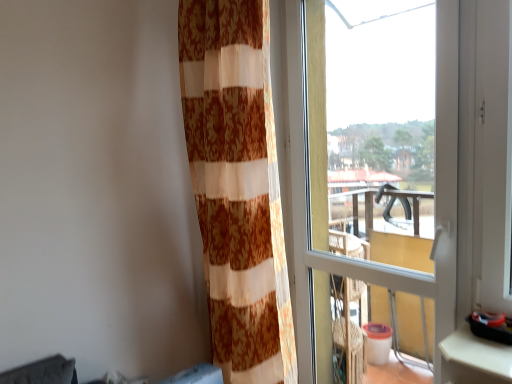
Describe the element at coordinates (435, 191) in the screenshot. I see `transparent glass window at right` at that location.

What are the coordinates of `transparent glass window at right` in the screenshot? It's located at (435, 191).

This screenshot has height=384, width=512. In order to click on orange floral sheer curtain at center in this screenshot , I will do `click(237, 186)`.

What do you see at coordinates (237, 186) in the screenshot?
I see `orange floral sheer curtain at center` at bounding box center [237, 186].

In order to face orange floral sheer curtain at center, should I rotate leftwards or rightwards?

Rotate left and turn 1.201 degrees.

At what (x,y) coordinates should I click in order to perform the action: click on transparent glass window at right. Please return your answer as a coordinate pair (x, y). Looking at the image, I should click on (435, 191).

Does transparent glass window at right appear on the right side of orange floral sheer curtain at center?

Yes.

Which is behind, transparent glass window at right or orange floral sheer curtain at center?

Positioned behind is orange floral sheer curtain at center.

Considering the positions of points (443, 277) and (236, 32), is point (443, 277) farther from camera compared to point (236, 32)?

No, it is not.

From the image's perspective, is transparent glass window at right located beneath orange floral sheer curtain at center?

Indeed, from the image's perspective, transparent glass window at right is shown beneath orange floral sheer curtain at center.

From a real-world perspective, is transparent glass window at right positioned under orange floral sheer curtain at center based on gravity?

Correct, in the physical world, transparent glass window at right is lower than orange floral sheer curtain at center.

Can you confirm if transparent glass window at right is thinner than orange floral sheer curtain at center?

Yes.

From their relative heights in the image, would you say transparent glass window at right is taller or shorter than orange floral sheer curtain at center?

Clearly, transparent glass window at right is taller compared to orange floral sheer curtain at center.

In terms of size, does transparent glass window at right appear bigger or smaller than orange floral sheer curtain at center?

transparent glass window at right is smaller than orange floral sheer curtain at center.

Does transparent glass window at right contain orange floral sheer curtain at center?

No, transparent glass window at right does not contain orange floral sheer curtain at center.

Is the surface of transparent glass window at right in direct contact with orange floral sheer curtain at center?

No, transparent glass window at right is not making contact with orange floral sheer curtain at center.

Is transparent glass window at right positioned with its back to orange floral sheer curtain at center?

Answer: Yes, transparent glass window at right is positioned with its back facing orange floral sheer curtain at center.

Can you tell me how much transparent glass window at right and orange floral sheer curtain at center differ in facing direction?

transparent glass window at right and orange floral sheer curtain at center are facing 1.72 degrees away from each other.

How distant is transparent glass window at right from orange floral sheer curtain at center?

transparent glass window at right is 16.49 inches away from orange floral sheer curtain at center.

Identify the location of window lying below the orange floral sheer curtain at center (from the image's perspective). (435, 191).

In the scene shown: Which object is positioned more to the left, orange floral sheer curtain at center or transparent glass window at right?

orange floral sheer curtain at center.

Based on the photo, is orange floral sheer curtain at center further to camera compared to transparent glass window at right?

Yes, orange floral sheer curtain at center is behind transparent glass window at right.

Is point (241, 207) in front of point (298, 98)?

Yes, point (241, 207) is in front of point (298, 98).

From the image's perspective, is orange floral sheer curtain at center located above or below transparent glass window at right?

From the image's perspective, orange floral sheer curtain at center appears above transparent glass window at right.

From a real-world perspective, is orange floral sheer curtain at center physically located above or below transparent glass window at right?

In terms of real-world spatial position, orange floral sheer curtain at center is above transparent glass window at right.

Can you confirm if orange floral sheer curtain at center is thinner than transparent glass window at right?

No.

Is orange floral sheer curtain at center taller than transparent glass window at right?

In fact, orange floral sheer curtain at center may be shorter than transparent glass window at right.

Consider the image. In terms of size, does orange floral sheer curtain at center appear bigger or smaller than transparent glass window at right?

Considering their sizes, orange floral sheer curtain at center takes up more space than transparent glass window at right.

Is orange floral sheer curtain at center surrounding transparent glass window at right?

No.

Are orange floral sheer curtain at center and transparent glass window at right making contact?

No, orange floral sheer curtain at center is not with transparent glass window at right.

Is orange floral sheer curtain at center oriented away from transparent glass window at right?

Yes, orange floral sheer curtain at center is facing away from transparent glass window at right.

Identify the location of curtain on the left of transparent glass window at right. The height and width of the screenshot is (384, 512). (237, 186).

Find the location of `curtain that appears above the transparent glass window at right (from a real-world perspective)`. curtain that appears above the transparent glass window at right (from a real-world perspective) is located at coordinates (237, 186).

Identify the location of window lying below the orange floral sheer curtain at center (from the image's perspective). (435, 191).